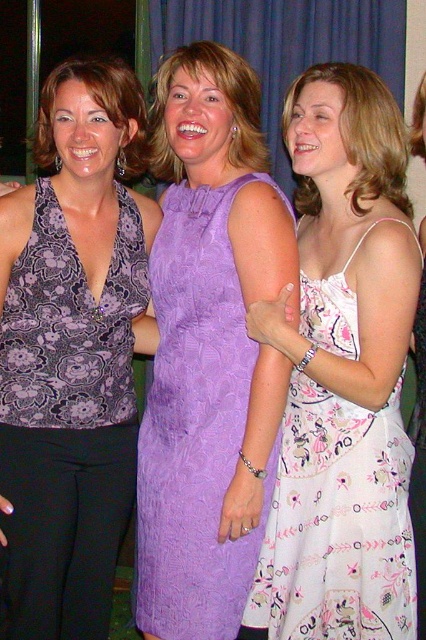
What do you see at coordinates (195, 422) in the screenshot? Image resolution: width=426 pixels, height=640 pixels. I see `lavender lace dress at center` at bounding box center [195, 422].

The image size is (426, 640). I want to click on lavender lace dress at center, so click(195, 422).

Is the position of lavender lace dress at center more distant than that of purple satin dress at center?

No, it is in front of purple satin dress at center.

Can you confirm if lavender lace dress at center is positioned to the right of purple satin dress at center?

Correct, you'll find lavender lace dress at center to the right of purple satin dress at center.

Between point (154, 586) and point (226, 81), which one is positioned behind?

Positioned behind is point (154, 586).

The image size is (426, 640). Find the location of `lavender lace dress at center`. lavender lace dress at center is located at coordinates (195, 422).

Between point (244, 90) and point (46, 97), which one is positioned in front?

Point (244, 90) is in front.

Is the position of purple satin dress at center less distant than that of matte purple dress at center?

Yes, it is.

Who is more forward, (x=160, y=141) or (x=86, y=67)?

Point (x=86, y=67) is more forward.

This screenshot has width=426, height=640. What are the coordinates of `purple satin dress at center` in the screenshot? It's located at 224,100.